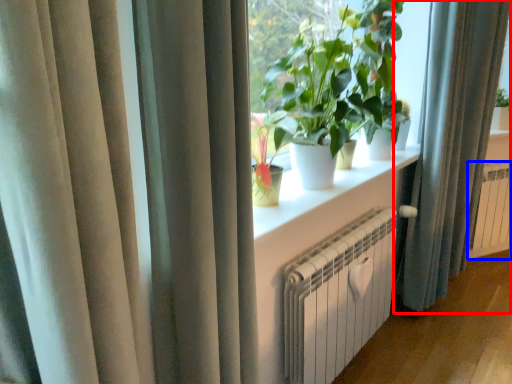
Question: Which object appears farthest to the camera in this image, curtain (highlighted by a red box) or radiator (highlighted by a blue box)?

Choices:
 (A) curtain
 (B) radiator

Answer: (B)